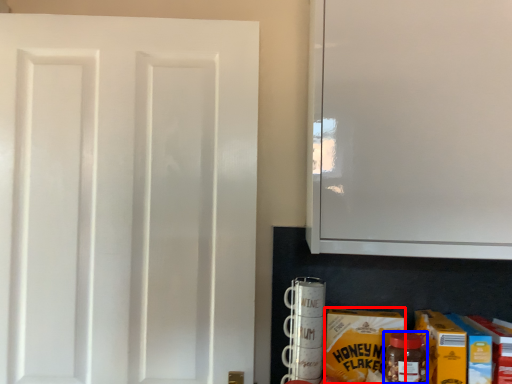
Question: Among these objects, which one is farthest to the camera, carton (highlighted by a red box) or bottle (highlighted by a blue box)?

Choices:
 (A) carton
 (B) bottle

Answer: (A)